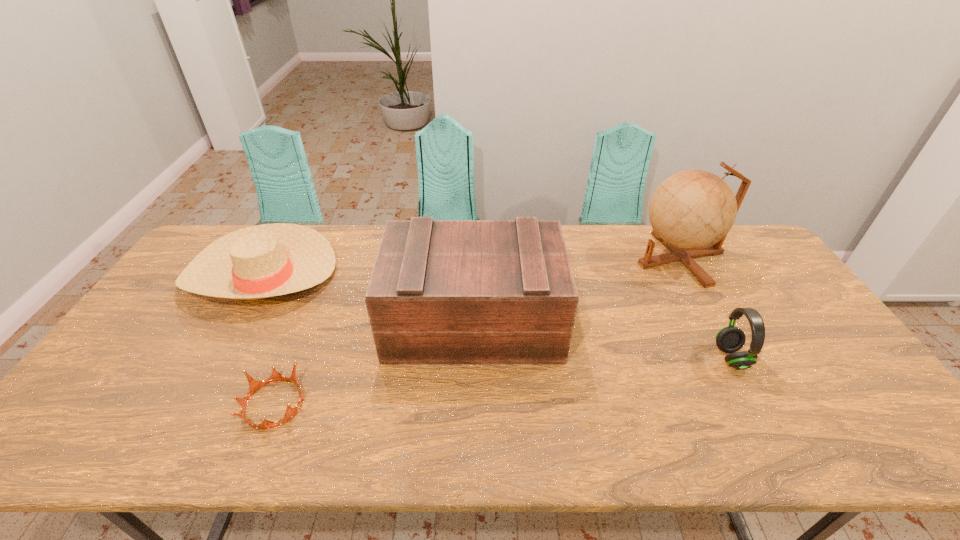
Locate an element on the screen. This screenshot has height=540, width=960. the tallest object is located at coordinates (691, 212).

The width and height of the screenshot is (960, 540). Find the location of `the fourth shortest object`. the fourth shortest object is located at coordinates (442, 292).

Image resolution: width=960 pixels, height=540 pixels. Identify the location of box. (442, 292).

Where is `the third shortest object`? Image resolution: width=960 pixels, height=540 pixels. the third shortest object is located at coordinates (730, 339).

This screenshot has width=960, height=540. In order to click on sunhat in this screenshot , I will do `click(267, 260)`.

The height and width of the screenshot is (540, 960). In order to click on crown in this screenshot , I will do `click(254, 385)`.

Identify the location of the nearest object. Image resolution: width=960 pixels, height=540 pixels. (254, 385).

The image size is (960, 540). Find the location of `blank space located 0.090m on the surface of the globe`. blank space located 0.090m on the surface of the globe is located at coordinates (609, 258).

Where is `free space located 0.090m on the surface of the globe`? This screenshot has height=540, width=960. free space located 0.090m on the surface of the globe is located at coordinates (609, 258).

Identify the location of vacant space located 0.380m on the surface of the globe. (521, 258).